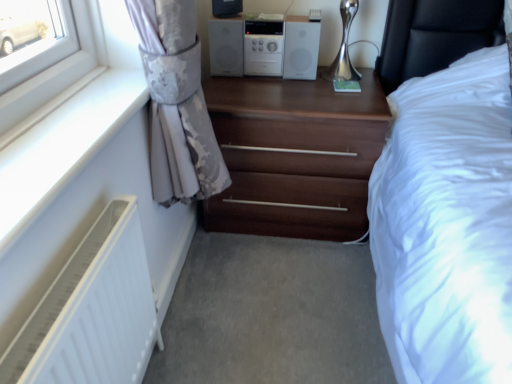
You are a GUI agent. You are given a task and a screenshot of the screen. Output one action in this format:
    pyautogui.click(x=<x>, y=<y>)
    Task: Click on the blank space above white plastic radiator at lower left (from a real-world perspective)
    The height and width of the screenshot is (384, 512).
    Given the screenshot: What is the action you would take?
    pyautogui.click(x=75, y=123)